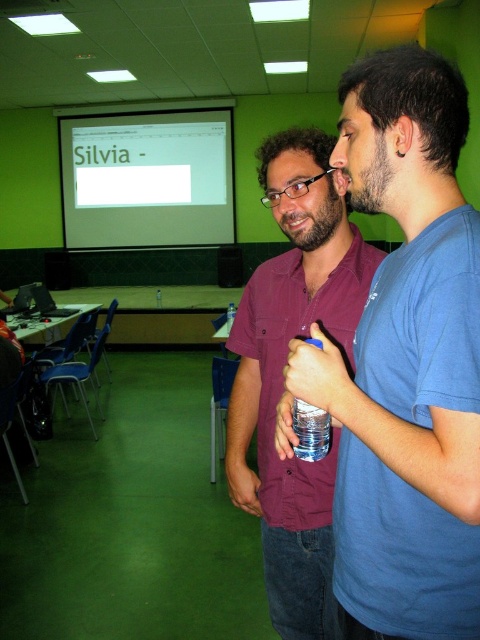
Question: Which of the following is the farthest from the observer?

Choices:
 (A) blue cotton t-shirt at center
 (B) white glossy projection screen at upper center

Answer: (B)

Question: Is the position of maroon shirt at center less distant than that of clear plastic bottle at center?

Choices:
 (A) no
 (B) yes

Answer: (A)

Question: Which point is farther to the camera?

Choices:
 (A) (324, 420)
 (B) (201, 141)
 (C) (370, 611)

Answer: (B)

Question: Is maroon shirt at center positioned before clear plastic bottle at center?

Choices:
 (A) yes
 (B) no

Answer: (B)

Question: Considering the real-world distances, which object is farthest from the maroon shirt at center?

Choices:
 (A) white glossy projection screen at upper center
 (B) clear plastic bottle at center

Answer: (A)

Question: From the image, what is the correct spatial relationship of maroon shirt at center in relation to clear plastic bottle at center?

Choices:
 (A) right
 (B) left

Answer: (B)